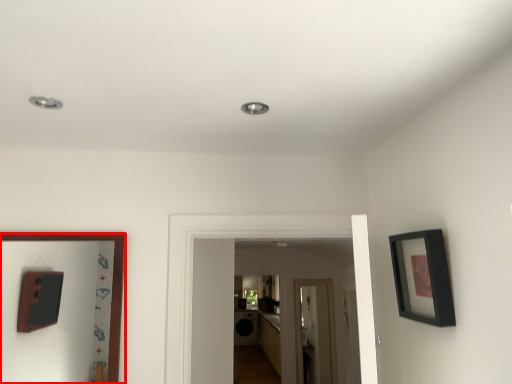
Question: From the image's perspective, considering the relative positions of picture frame (annotated by the red box) and picture frame in the image provided, where is picture frame (annotated by the red box) located with respect to the staircase?

Choices:
 (A) above
 (B) below

Answer: (B)